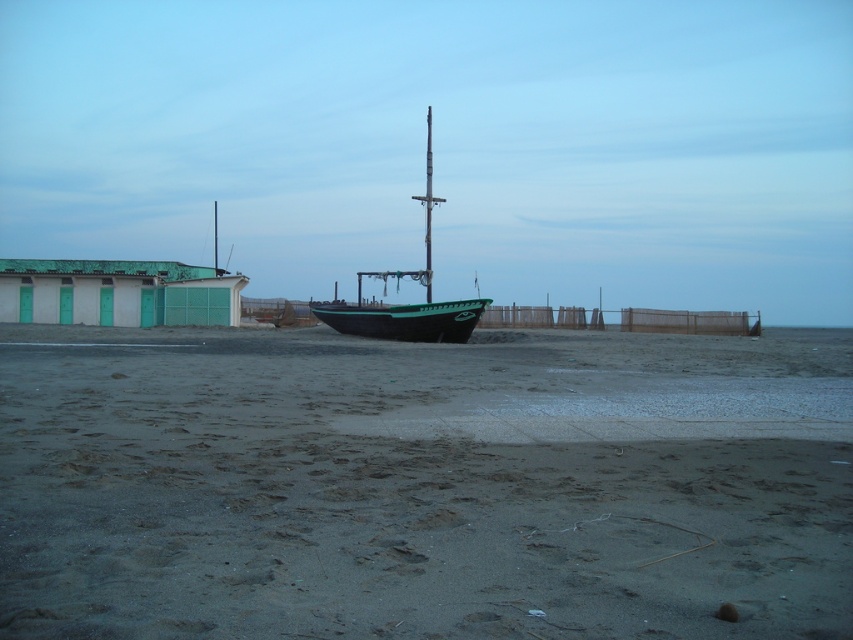
You are a beachcomber searching for items on the beach. You notice the gray sand at center and the green matte boat at center. Which object takes up more space in the image?

The green matte boat at center takes up more space in the image because it is larger than the gray sand at center.